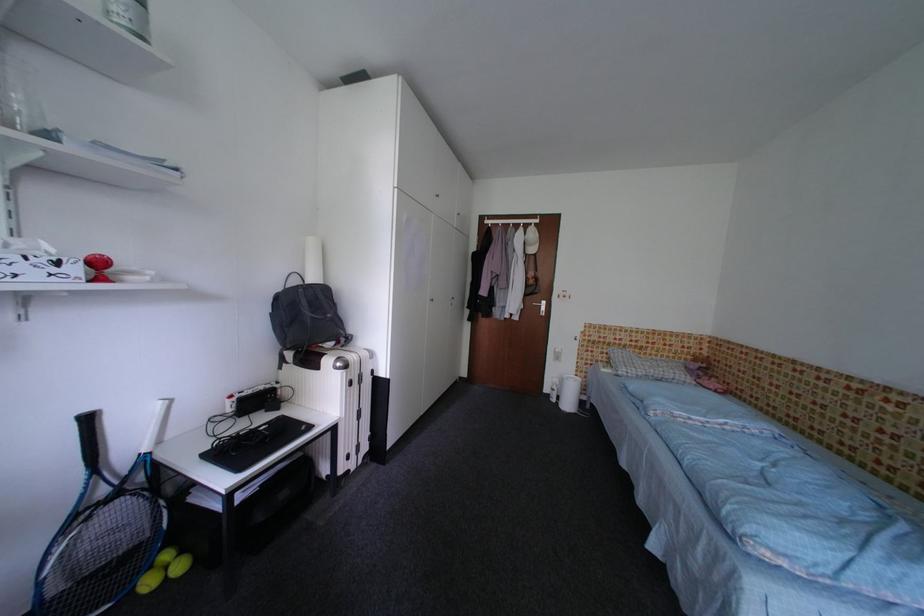
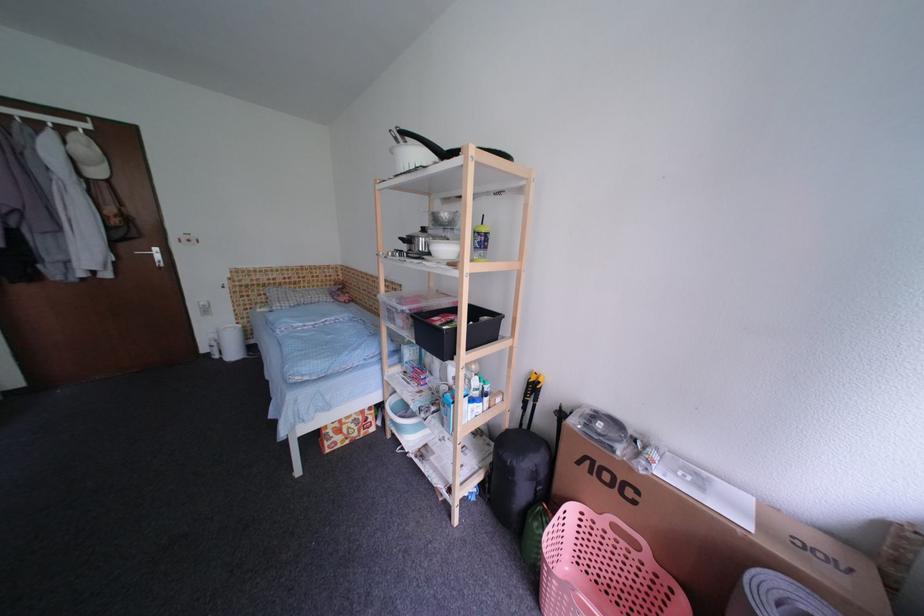
Based on the continuous images, in which direction is the camera rotating?

The camera's rotation is toward right-down.